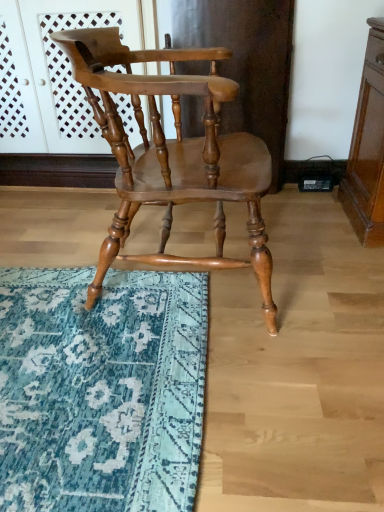
Question: From the image's perspective, is matte wood screen door at upper center over teal rug at lower left?

Choices:
 (A) no
 (B) yes

Answer: (B)

Question: Is matte wood screen door at upper center aimed at teal rug at lower left?

Choices:
 (A) no
 (B) yes

Answer: (B)

Question: Is matte wood screen door at upper center wider than teal rug at lower left?

Choices:
 (A) no
 (B) yes

Answer: (A)

Question: Would you consider matte wood screen door at upper center to be distant from teal rug at lower left?

Choices:
 (A) yes
 (B) no

Answer: (A)

Question: Can you confirm if matte wood screen door at upper center is smaller than teal rug at lower left?

Choices:
 (A) no
 (B) yes

Answer: (A)

Question: Considering the positions of teal rug at lower left and shiny brown wood chair at center in the image, is teal rug at lower left wider or thinner than shiny brown wood chair at center?

Choices:
 (A) wide
 (B) thin

Answer: (A)

Question: From their relative heights in the image, would you say teal rug at lower left is taller or shorter than shiny brown wood chair at center?

Choices:
 (A) tall
 (B) short

Answer: (B)

Question: Considering their positions, is teal rug at lower left located in front of or behind shiny brown wood chair at center?

Choices:
 (A) front
 (B) behind

Answer: (B)

Question: From the image's perspective, relative to shiny brown wood chair at center, is teal rug at lower left above or below?

Choices:
 (A) above
 (B) below

Answer: (B)

Question: From the image's perspective, is shiny brown wood chair at center located above or below teal rug at lower left?

Choices:
 (A) above
 (B) below

Answer: (A)

Question: In the image, is shiny brown wood chair at center on the left side or the right side of teal rug at lower left?

Choices:
 (A) left
 (B) right

Answer: (B)

Question: Is shiny brown wood chair at center taller or shorter than teal rug at lower left?

Choices:
 (A) tall
 (B) short

Answer: (A)

Question: From a real-world perspective, is shiny brown wood chair at center physically located above or below teal rug at lower left?

Choices:
 (A) above
 (B) below

Answer: (A)

Question: Is matte wood screen door at upper center inside the boundaries of teal rug at lower left, or outside?

Choices:
 (A) outside
 (B) inside

Answer: (A)

Question: From the image's perspective, is matte wood screen door at upper center located above or below teal rug at lower left?

Choices:
 (A) above
 (B) below

Answer: (A)